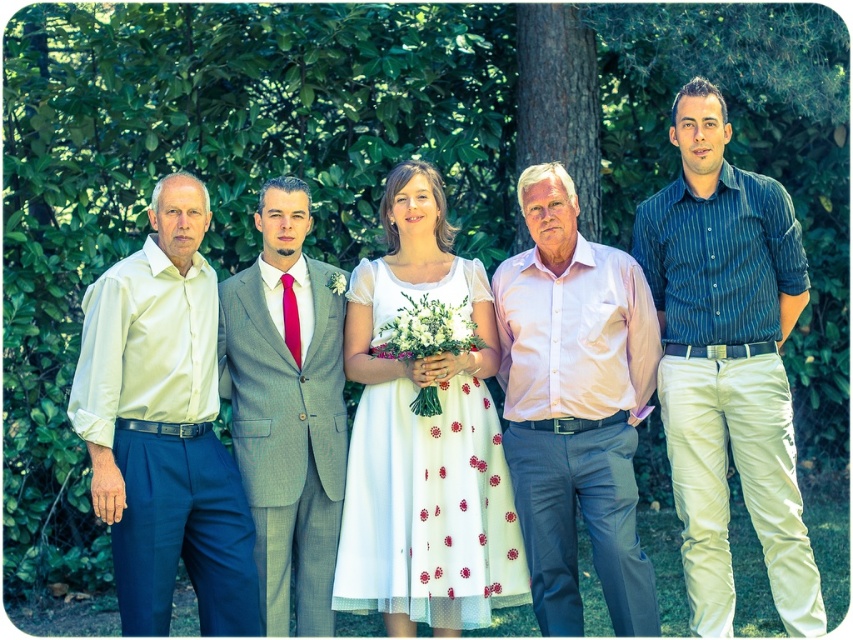
Consider the image. Who is positioned more to the right, blue striped shirt at center or gray wool suit at center?

blue striped shirt at center is more to the right.

Which is behind, point (704, 208) or point (300, 513)?

Positioned behind is point (300, 513).

Which is behind, point (743, 412) or point (303, 285)?

The point (303, 285) is more distant.

The width and height of the screenshot is (853, 640). What are the coordinates of `blue striped shirt at center` in the screenshot? It's located at (727, 364).

Who is shorter, light beige satin shirt at left or pink satin shirt at center?

Standing shorter between the two is light beige satin shirt at left.

Does light beige satin shirt at left appear on the left side of pink satin shirt at center?

Correct, you'll find light beige satin shirt at left to the left of pink satin shirt at center.

Where is `light beige satin shirt at left`? Image resolution: width=853 pixels, height=640 pixels. light beige satin shirt at left is located at coordinates (164, 428).

Find the location of `light beige satin shirt at left`. light beige satin shirt at left is located at coordinates (164, 428).

The width and height of the screenshot is (853, 640). Describe the element at coordinates (428, 508) in the screenshot. I see `white textured fabric dress at center` at that location.

Which of these two, white textured fabric dress at center or gray wool suit at center, stands taller?

With more height is gray wool suit at center.

Does point (361, 433) come in front of point (306, 202)?

Yes.

I want to click on white textured fabric dress at center, so click(x=428, y=508).